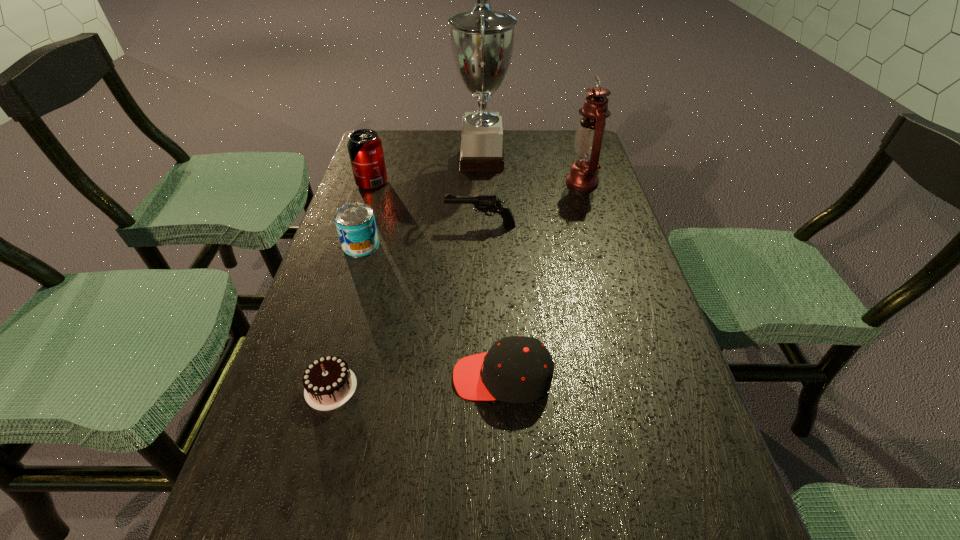
Identify the location of free location that satisfies the following two spatial constraints: 1. on the back side of the rightmost object; 2. on the right side of the fifth shortest object. (372, 182).

Find the location of a particular element. The image size is (960, 540). free space that satisfies the following two spatial constraints: 1. at the front view of the rightmost object; 2. on the left side of the trophy cup is located at coordinates (482, 182).